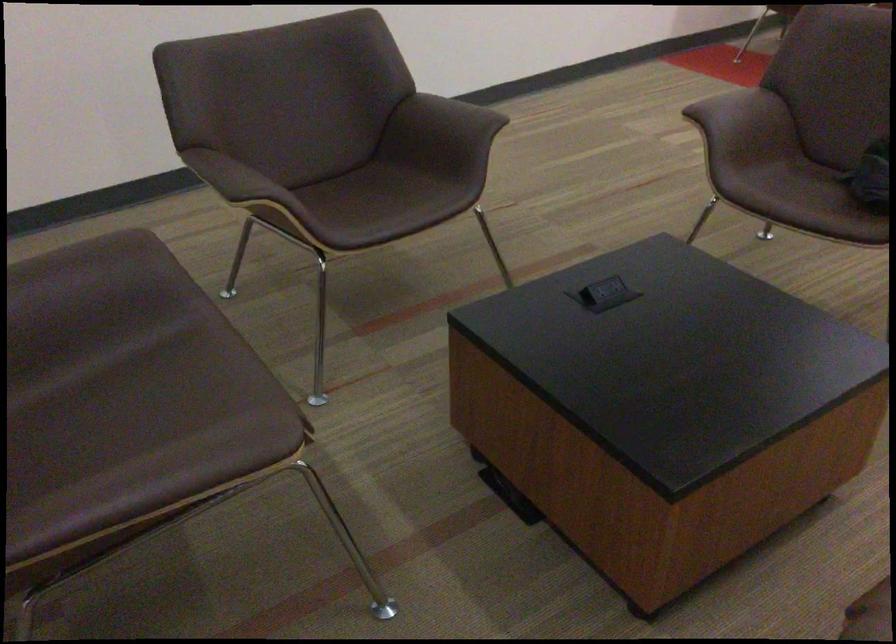
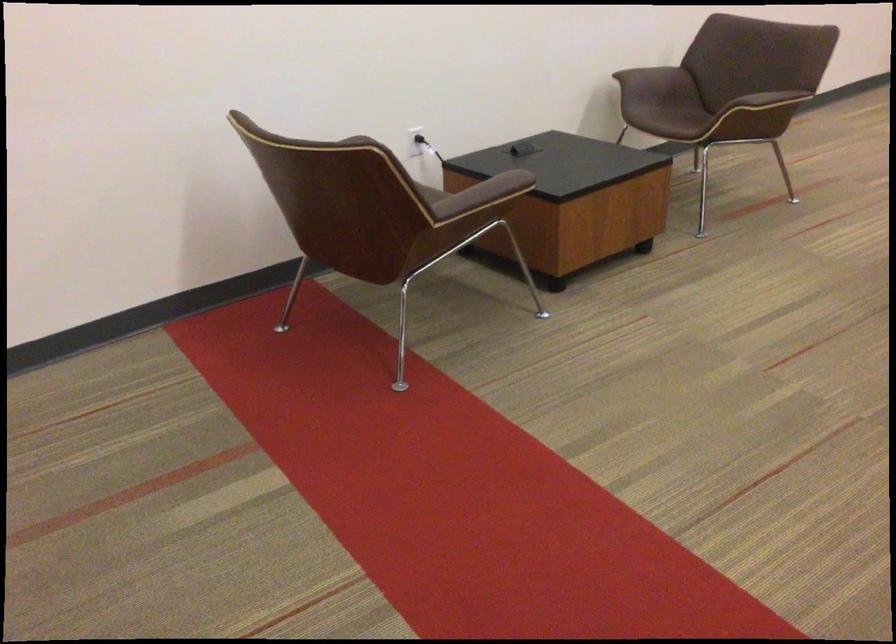
What movement of the cameraman would produce the second image?

The cameraman walked toward right, forward.